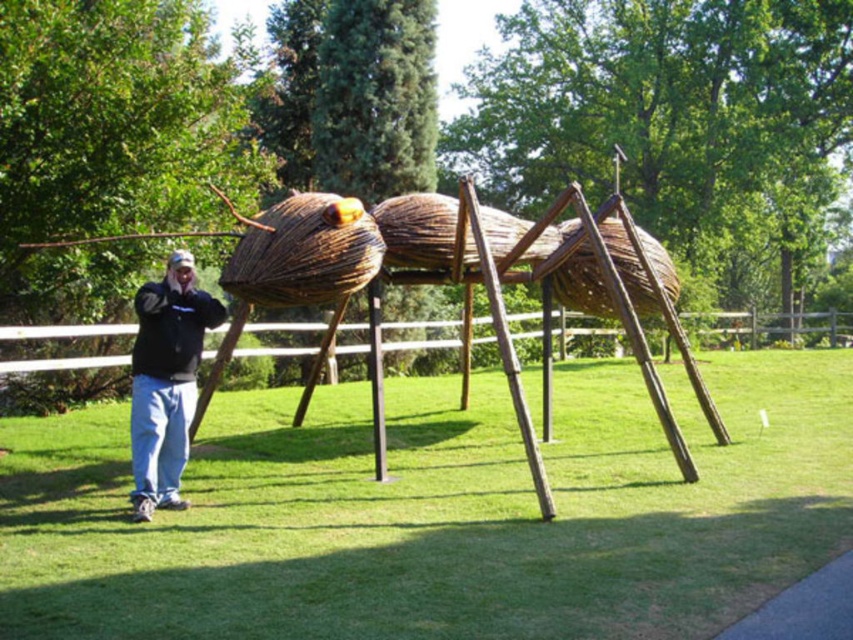
What do you see at coordinates (437, 513) in the screenshot?
I see `green grass at center` at bounding box center [437, 513].

Does green grass at center have a lesser width compared to black fleece jacket at lower left?

Incorrect, green grass at center's width is not less than black fleece jacket at lower left's.

Does point (341, 452) come in front of point (137, 420)?

No, it is behind (137, 420).

Find the location of a particular element. The image size is (853, 640). green grass at center is located at coordinates (437, 513).